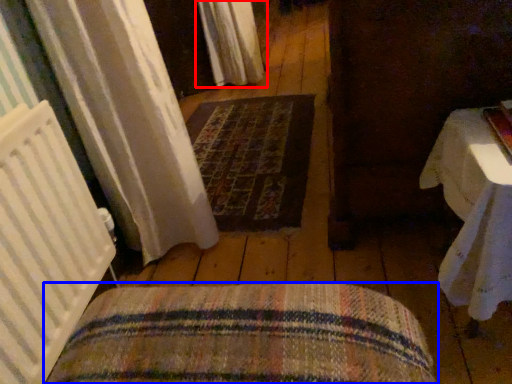
Question: Which point is closer to the camera, curtain (highlighted by a red box) or furniture (highlighted by a blue box)?

Choices:
 (A) curtain
 (B) furniture

Answer: (B)